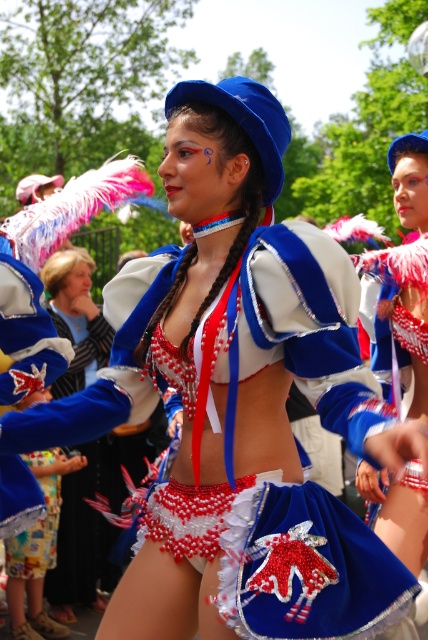
Can you confirm if velvet blue skirt at center is positioned to the right of velvet blue shorts at center?

Correct, you'll find velvet blue skirt at center to the right of velvet blue shorts at center.

Find the location of `velvet blue skirt at center`. velvet blue skirt at center is located at coordinates (404, 273).

This screenshot has width=428, height=640. In order to click on velvet blue skirt at center in this screenshot , I will do `click(404, 273)`.